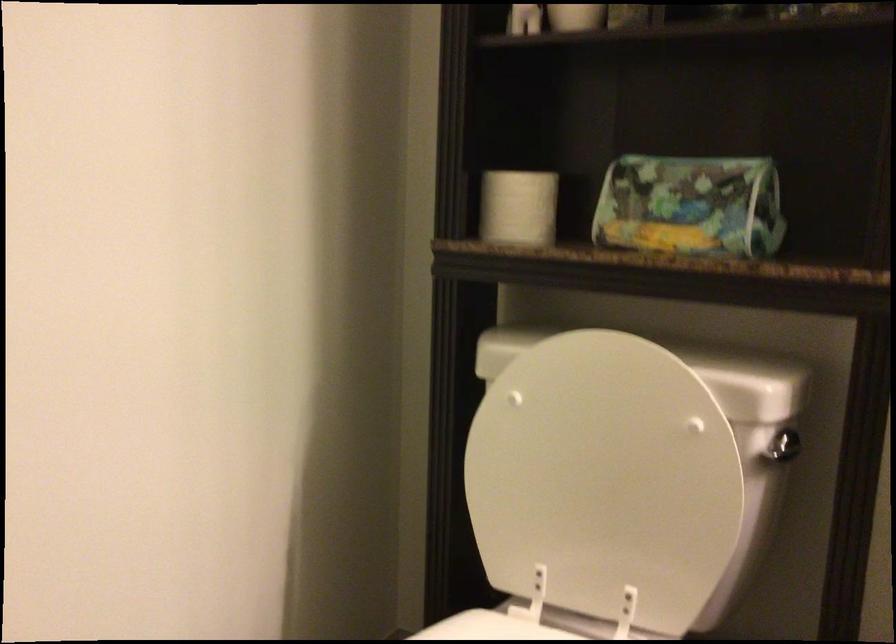
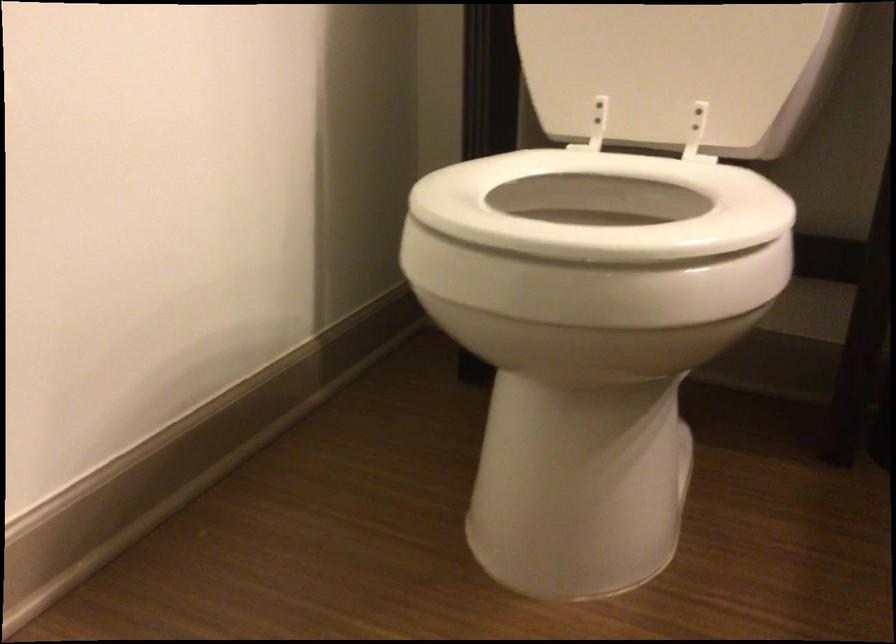
Question: Based on the continuous images, in which direction is the camera rotating? Reply with the corresponding letter.

Choices:
 (A) Left
 (B) Right
 (C) Up
 (D) Down

Answer: (D)